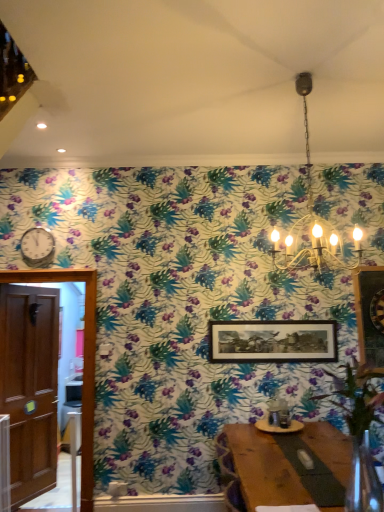
This screenshot has height=512, width=384. What are the coordinates of `blank space situated above wooden framed picture at center (from a real-world perspective)` in the screenshot? It's located at (270, 321).